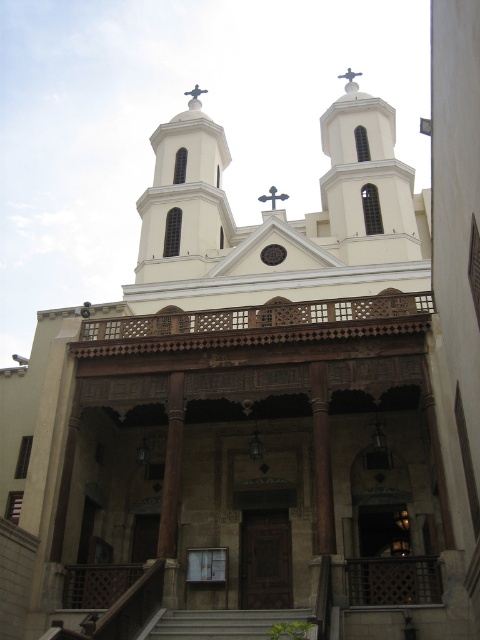
Question: Does white smooth tower at center appear on the left side of gray concrete stairs at center?

Choices:
 (A) yes
 (B) no

Answer: (A)

Question: Is gray concrete stairs at center further to camera compared to metallic cross at center?

Choices:
 (A) yes
 (B) no

Answer: (B)

Question: Which object is positioned closest to the white stone tower at upper center?

Choices:
 (A) gray concrete stairs at center
 (B) white smooth tower at center

Answer: (B)

Question: Which object appears closest to the camera in this image?

Choices:
 (A) metallic cross at center
 (B) gray concrete stairs at center
 (C) white stone tower at upper center

Answer: (B)

Question: Is gray concrete stairs at center further to camera compared to metallic cross at center?

Choices:
 (A) no
 (B) yes

Answer: (A)

Question: Which point is farther from the camera taking this photo?

Choices:
 (A) (274, 188)
 (B) (361, 141)
 (C) (256, 625)
 (D) (205, 211)

Answer: (B)